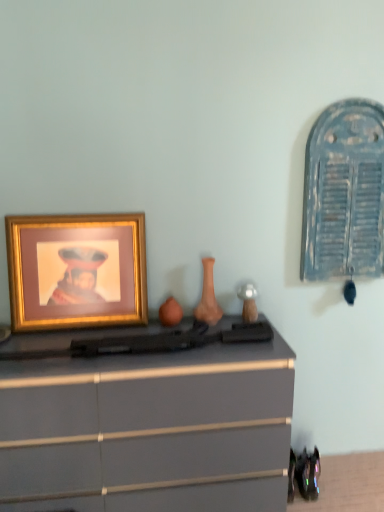
You are a GUI agent. You are given a task and a screenshot of the screen. Output one action in this format:
    pyautogui.click(x=<x>, y=<y>)
    Task: Click on the vacant space that is to the left of matte orange vase at center
    Image resolution: width=384 pixels, height=512 pixels.
    Given the screenshot: What is the action you would take?
    pyautogui.click(x=173, y=325)